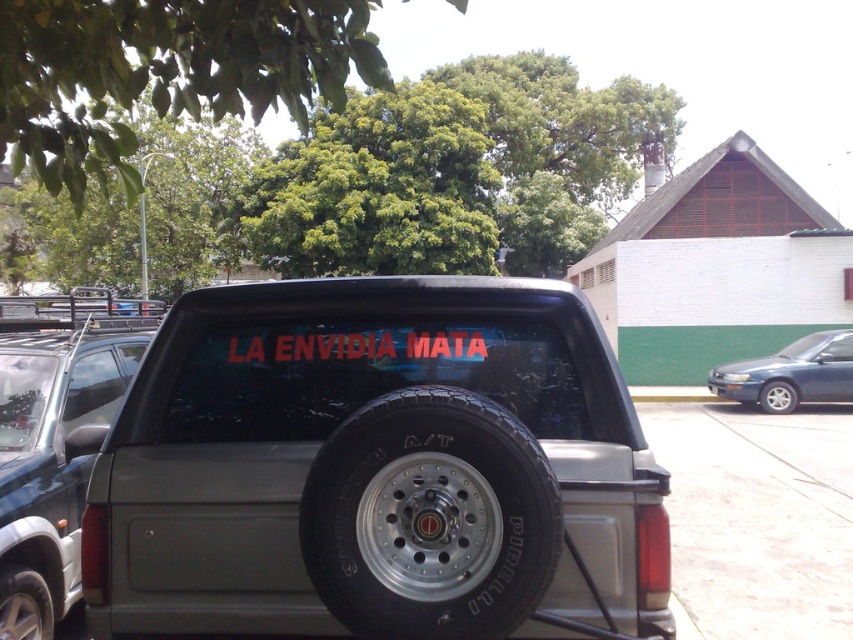
You are a delivery driver who needs to load a package onto the tailgate of the gray pickup truck. The package is too heavy to lift over the tailgate. You have a ramp that can be placed between the black rubber tire at center and the black rubber tire at lower center. Will the ramp fit between them?

The black rubber tire at center is above the black rubber tire at lower center, so the ramp cannot be placed between them because they are vertically aligned rather than horizontally spaced apart.

You are standing at the origin point in the parking lot. The metallic gray pickup truck at center is located at point 0.734, 0.440. If you want to walk directly to the truck, in which direction should you move?

You should move towards the coordinates (374, 468) to reach the metallic gray pickup truck at center.

You are a delivery driver who needs to read the text on the truck to confirm the delivery address. The black rubber tire at lower left is blocking your view. How can you adjust your position to see the black matte text at center clearly?

Since the black matte text at center is above the black rubber tire at lower left, you can move to the right side of the truck to get a clear view of the text without the tire obstructing your view.